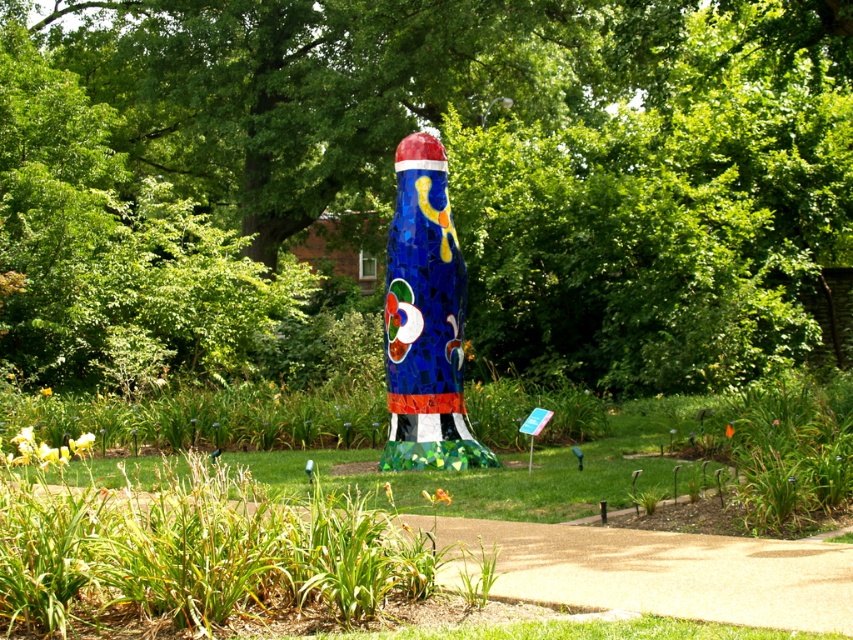
You are standing in the garden looking at the sculpture. You notice two points marked in the scene. Which point is closer to you, point (80, 381) or point (396, 220)?

Point (80, 381) is closer to you because it is further to the viewer than point (396, 220).

You are standing at the entrance of the garden and want to locate the mosaic sculpture at center. According to the coordinates provided, where should you look?

The mosaic sculpture at center is located at coordinates point (450, 177).

You are a gardener standing in front of the mosaic sculpture at center and the shiny mosaic totem pole at center. Which object is closer to you?

The mosaic sculpture at center is closer to you because the shiny mosaic totem pole at center is behind it.